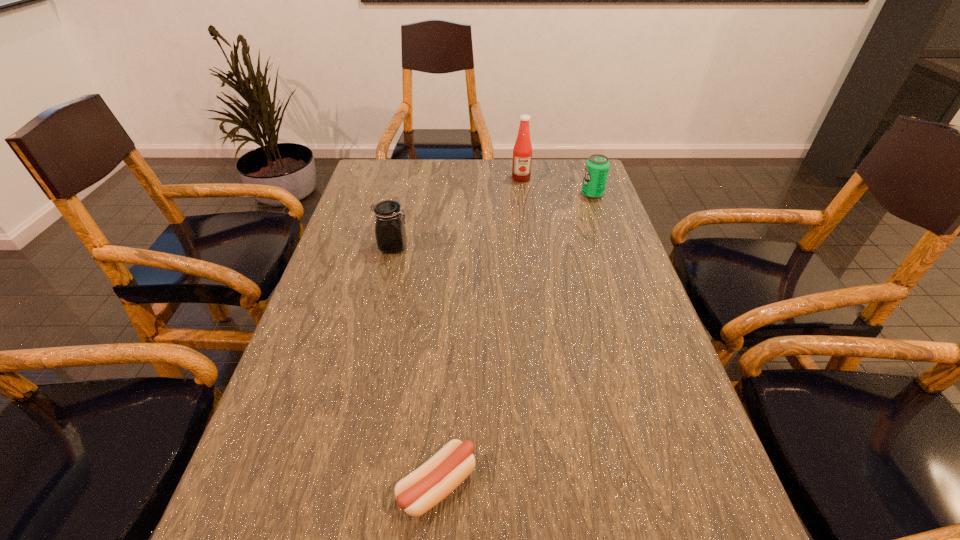
The width and height of the screenshot is (960, 540). Identify the location of free spot that satisfies the following two spatial constraints: 1. on the lid of the nearest object; 2. on the left side of the leftmost object. (337, 485).

This screenshot has width=960, height=540. Identify the location of free location that satisfies the following two spatial constraints: 1. on the lid of the shortest object; 2. on the left side of the leftmost object. (337, 485).

Image resolution: width=960 pixels, height=540 pixels. In order to click on vacant space that satisfies the following two spatial constraints: 1. on the front-facing side of the tallest object; 2. on the lid of the third farthest object in this screenshot , I will do `click(530, 247)`.